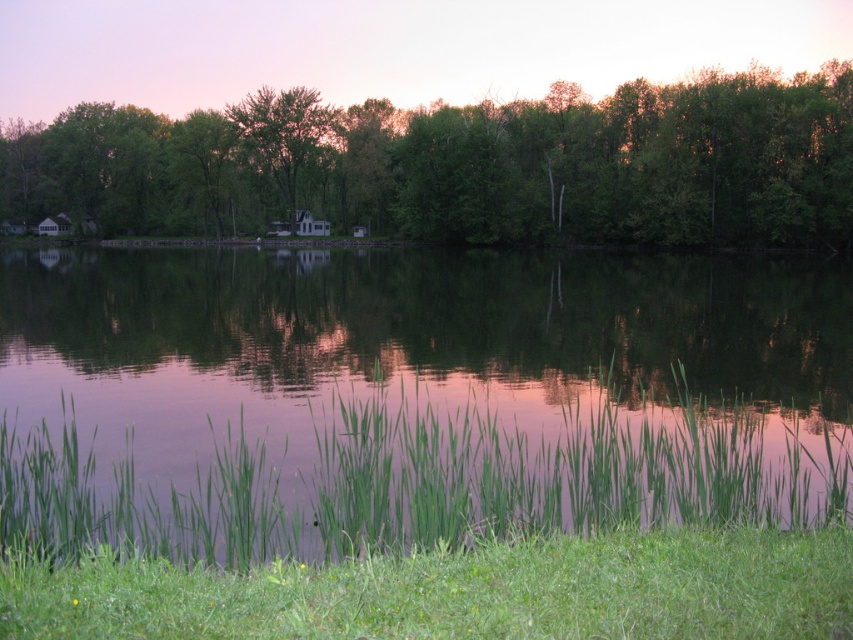
You are standing on the lakeside and looking towards the dense line of trees. Which of the two objects, the green leafy trees at center or the green matte tree at center, is positioned lower in the scene?

The green leafy trees at center is positioned lower than the green matte tree at center according to the description.

You are standing at the lakeside and want to take a photo that includes both the green grassy water at center and the green leafy trees at center. Based on their positions, which one will appear closer to you in the photo?

The green grassy water at center appears closer to you in the photo because it is positioned in front of the green leafy trees at center.